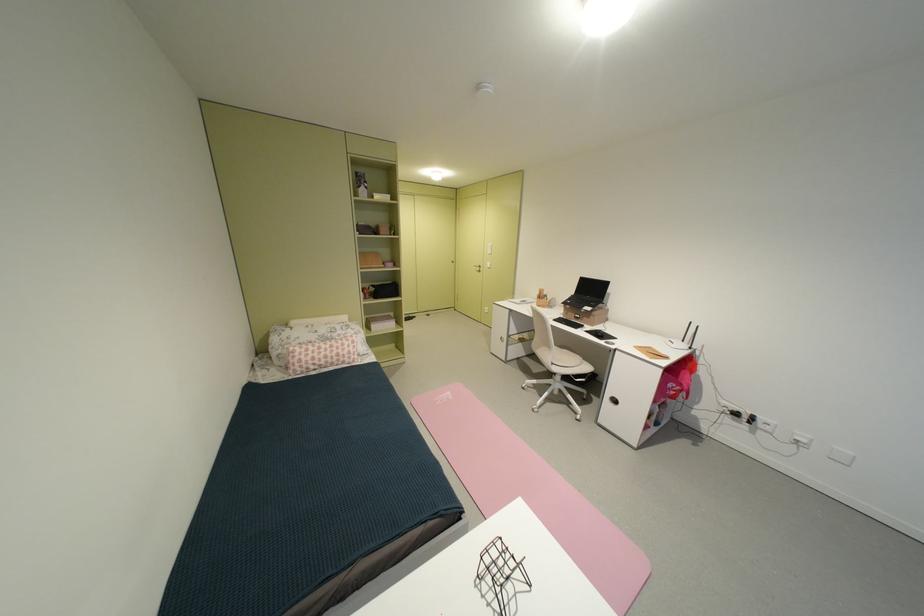
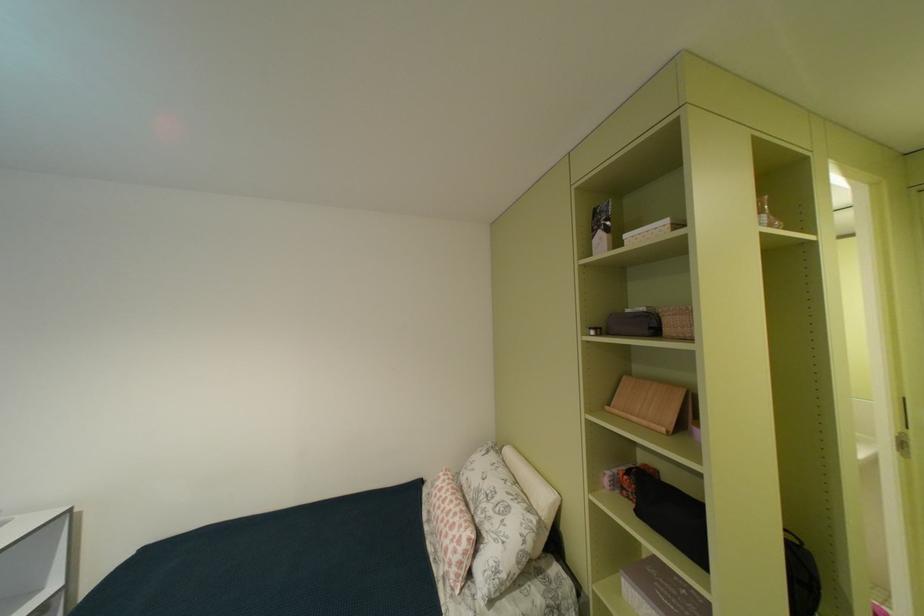
Locate, in the second image, the point that corresponds to point (326, 338) in the first image.

(487, 487)